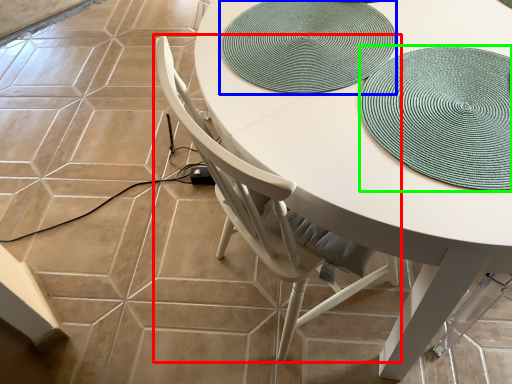
Question: Based on their relative distances, which object is nearer to chair (highlighted by a red box)? Choose from mat (highlighted by a blue box) and hat (highlighted by a green box).

Choices:
 (A) mat
 (B) hat

Answer: (A)